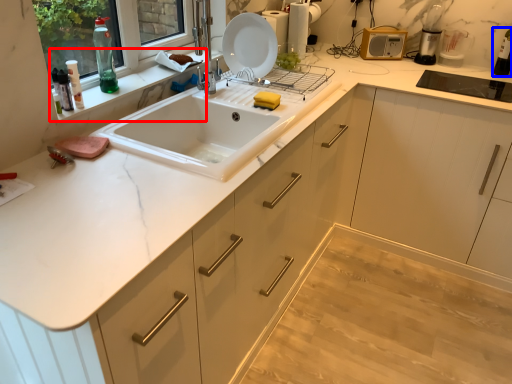
Question: Which object is further to the camera taking this photo, window sill (highlighted by a red box) or bottle (highlighted by a blue box)?

Choices:
 (A) window sill
 (B) bottle

Answer: (B)